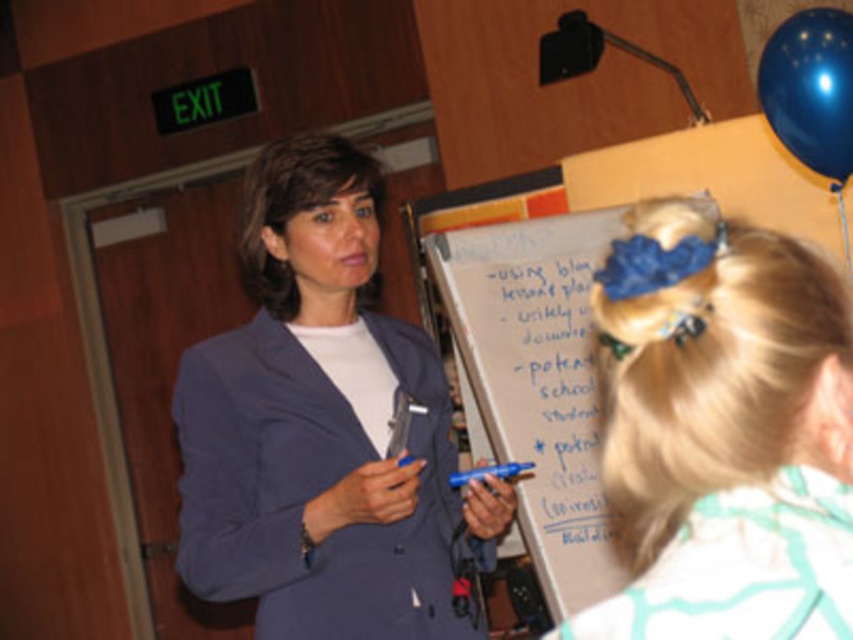
You are attending a meeting and see the matte blue blazer at center and the blue rubber balloon at upper right. Which object is taller?

The matte blue blazer at center is taller than the blue rubber balloon at upper right.

You are organizing a meeting and need to ensure there is enough space between the presenter and the whiteboard for a 30 inch projector. Based on the scene, will the current distance between the matte blue blazer at center and the whiteboard at center allow for placing the projector between them?

The matte blue blazer at center is 27.33 inches from the whiteboard at center. Since the projector requires 30 inches of space, the current distance is insufficient. The presenter would need to move back or the whiteboard adjusted to accommodate the projector.